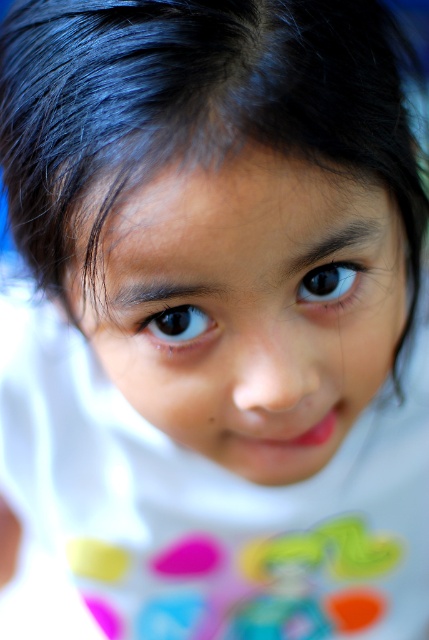
Question: Which point appears closest to the camera in this image?

Choices:
 (A) (69, 291)
 (B) (196, 314)
 (C) (308, 282)

Answer: (B)

Question: Is smooth skin face at center wider than brown glossy eye at center?

Choices:
 (A) no
 (B) yes

Answer: (B)

Question: Can you confirm if smooth skin face at center is positioned to the left of black glossy eye at center?

Choices:
 (A) yes
 (B) no

Answer: (A)

Question: Which point is farther to the camera?

Choices:
 (A) (244, 230)
 (B) (338, 266)
 (C) (183, 310)

Answer: (B)

Question: Is brown glossy eye at center further to camera compared to black glossy eye at center?

Choices:
 (A) no
 (B) yes

Answer: (A)

Question: Which object is positioned farthest from the black glossy eye at center?

Choices:
 (A) brown glossy eye at center
 (B) smooth skin face at center

Answer: (B)